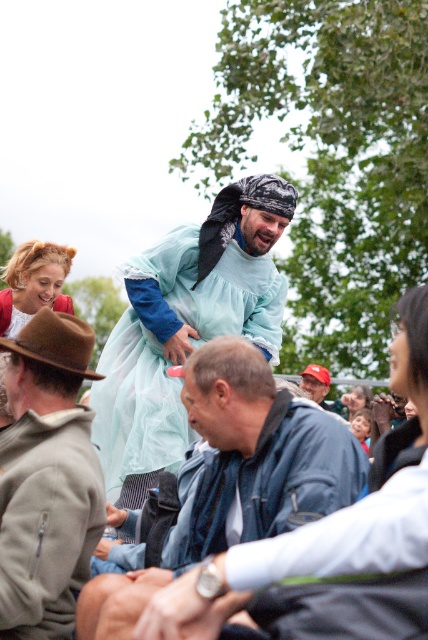
Question: Does brown suede hat at left lie in front of red cap at center?

Choices:
 (A) yes
 (B) no

Answer: (A)

Question: Which point is farther to the camera?

Choices:
 (A) red cap at center
 (B) blonde hair wig at upper left

Answer: (A)

Question: Which point is farther to the camera?

Choices:
 (A) (30, 340)
 (B) (14, 289)
 (C) (181, 272)
 (D) (312, 394)

Answer: (D)

Question: Can you confirm if blonde hair wig at upper left is bigger than red cap at center?

Choices:
 (A) yes
 (B) no

Answer: (A)

Question: Does blonde hair wig at upper left appear on the right side of red cap at center?

Choices:
 (A) yes
 (B) no

Answer: (B)

Question: Which of these objects is positioned closest to the denim jacket at center?

Choices:
 (A) blonde hair wig at upper left
 (B) brown suede hat at left

Answer: (B)